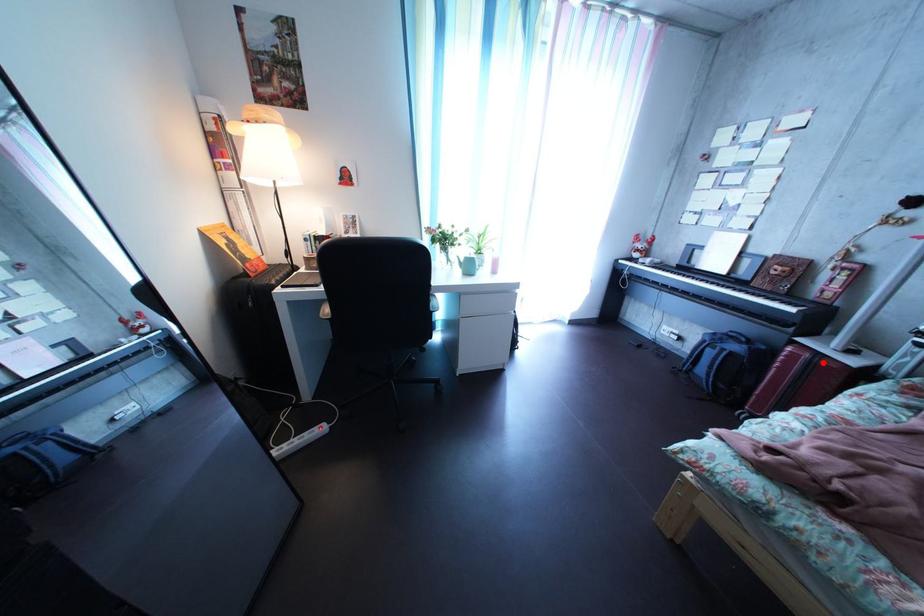
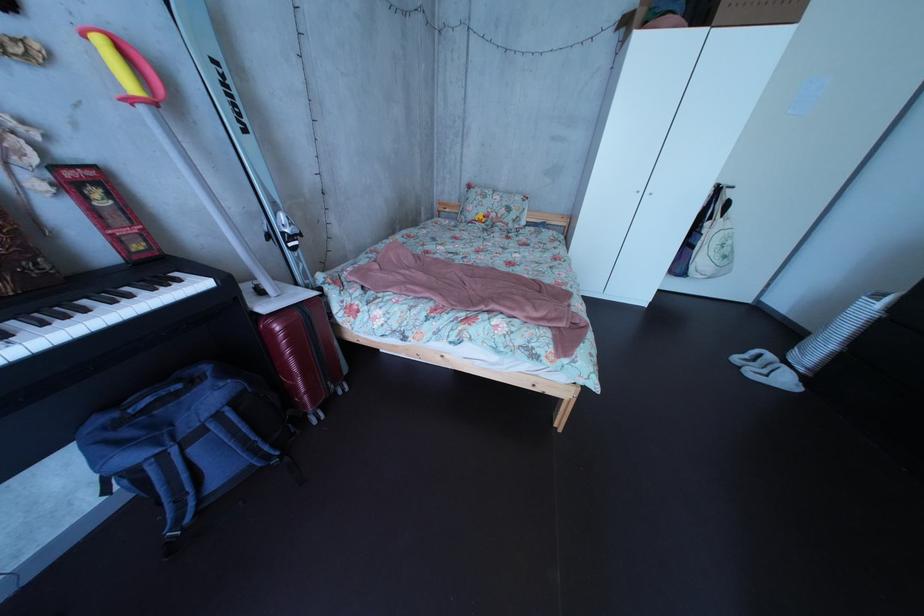
Question: A red point is marked in image1. In image2, is the corresponding 3D point closer to the camera or farther? Reply with the corresponding letter.

Choices:
 (A) The corresponding 3D point is closer.
 (B) The corresponding 3D point is farther.

Answer: (A)